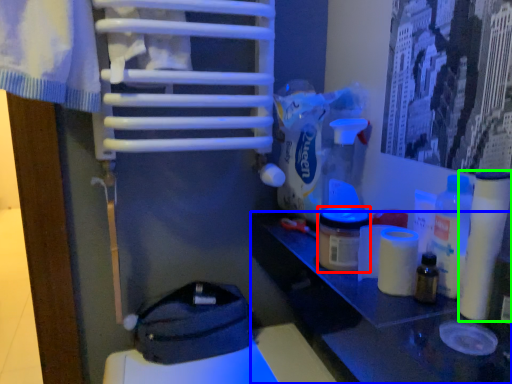
Question: Considering the real-world distances, which object is closest to product (highlighted by a red box)? table (highlighted by a blue box) or toilet paper (highlighted by a green box).

Choices:
 (A) table
 (B) toilet paper

Answer: (A)